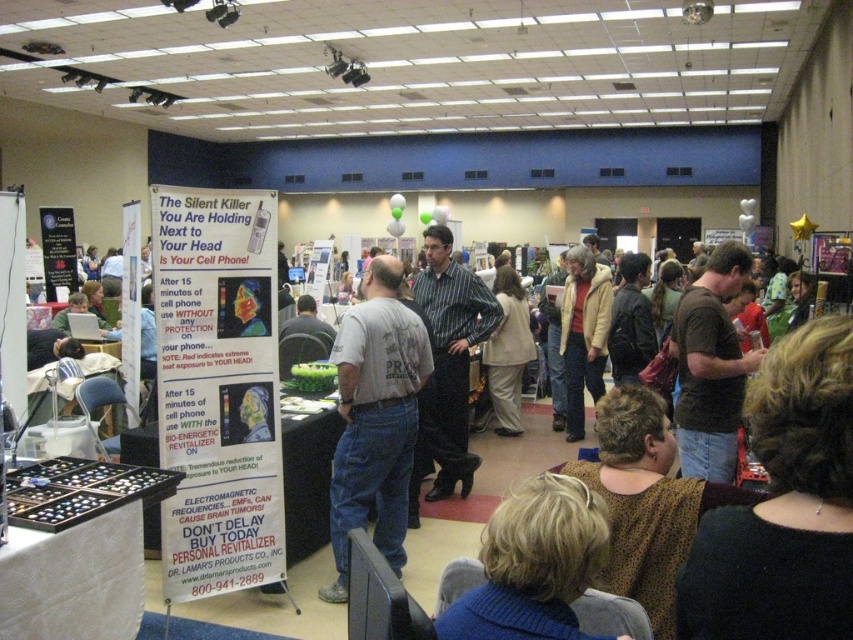
Question: Which object appears farthest from the camera in this image?

Choices:
 (A) dark brown leather jacket at center
 (B) gray cotton t-shirt at center

Answer: (A)

Question: Is the position of gray cotton t-shirt at center more distant than that of dark brown t-shirt at center-right?

Choices:
 (A) yes
 (B) no

Answer: (A)

Question: Does dark brown t-shirt at center-right have a lesser width compared to dark brown leather jacket at center?

Choices:
 (A) yes
 (B) no

Answer: (B)

Question: Is gray cotton t-shirt at center smaller than dark brown t-shirt at center-right?

Choices:
 (A) no
 (B) yes

Answer: (A)

Question: Which object is closer to the camera taking this photo?

Choices:
 (A) dark brown leather jacket at center
 (B) gray cotton t-shirt at center

Answer: (B)

Question: Which object is closer to the camera taking this photo?

Choices:
 (A) gray cotton t-shirt at center
 (B) dark brown t-shirt at center-right
 (C) striped cotton shirt at center

Answer: (B)